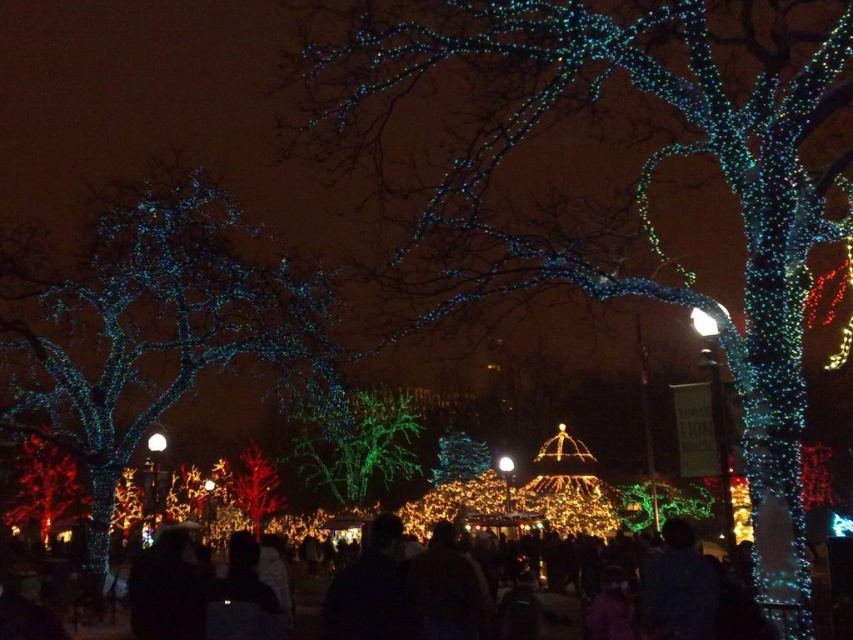
You are a drone operator tasked with capturing aerial footage of the festive lights. Your drone has a maximum flight range of 50 meters. If you are currently positioned above the illuminated wire at upper center, can you safely fly the drone to the illuminated wire at left without exceeding its range?

The distance between the illuminated wire at upper center and the illuminated wire at left is 49.74 meters, which is within the drone operator s 50 meters range. Therefore, the drone can safely fly from the illuminated wire at upper center to the illuminated wire at left without exceeding its maximum flight range.

You are standing in the festive nighttime scene and want to take a photo of both the illuminated wire at upper center and the illuminated wire at left. Which one should you adjust your camera angle to capture first if you want to start from the leftmost position?

You should adjust your camera angle to capture the illuminated wire at left first since it is positioned to the left of the illuminated wire at upper center.